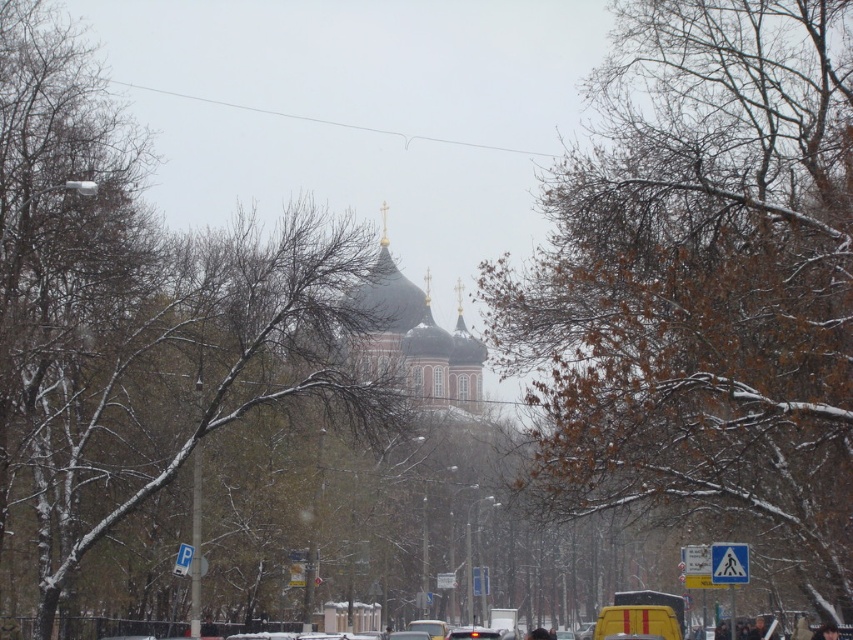
Is brown leafy tree at center further to the viewer compared to snow-covered branches at center?

No.

Measure the distance between point (776, 20) and camera.

Point (776, 20) and camera are 140.57 feet apart.

Where is `brown leafy tree at center`? brown leafy tree at center is located at coordinates (701, 282).

You are a GUI agent. You are given a task and a screenshot of the screen. Output one action in this format:
    pyautogui.click(x=<x>, y=<y>)
    Task: Click on the brown leafy tree at center
    
    Given the screenshot: What is the action you would take?
    pyautogui.click(x=701, y=282)